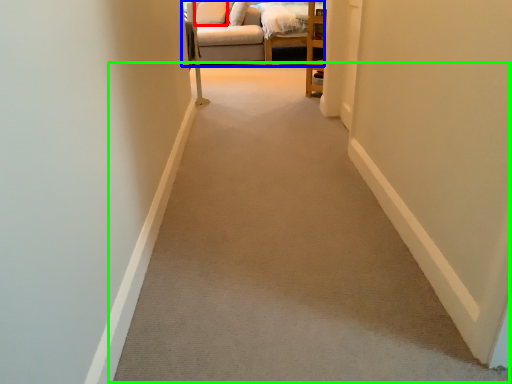
Question: Which object is the farthest from pillow (highlighted by a red box)? Choose among these: studio couch (highlighted by a blue box) or path (highlighted by a green box).

Choices:
 (A) studio couch
 (B) path

Answer: (B)